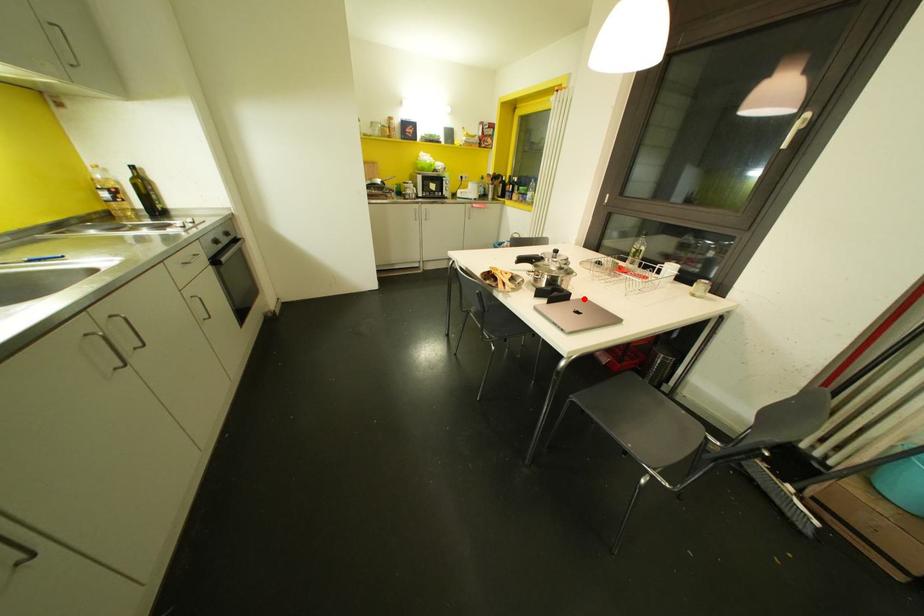
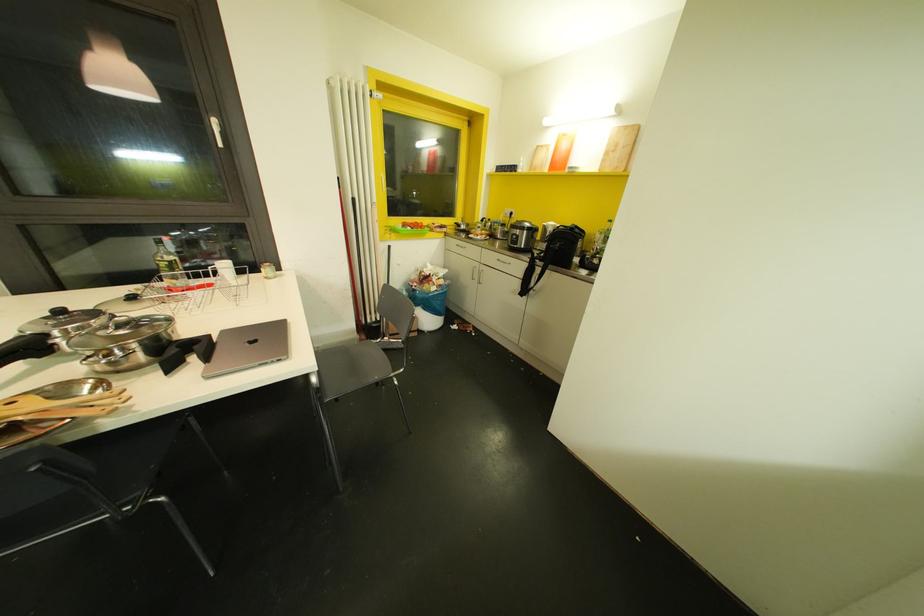
Where in the second image is the point corresponding to the highlighted location from the first image?

(223, 331)